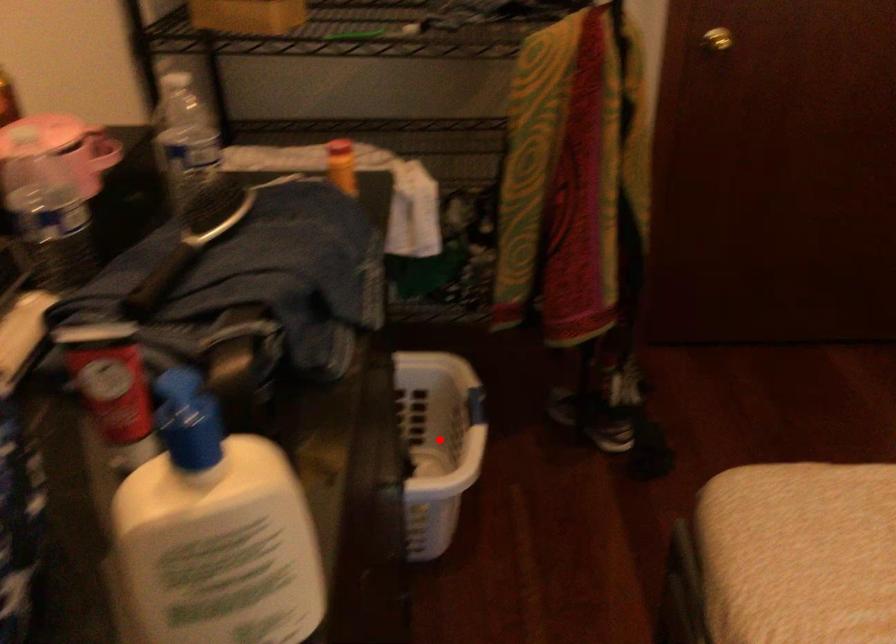
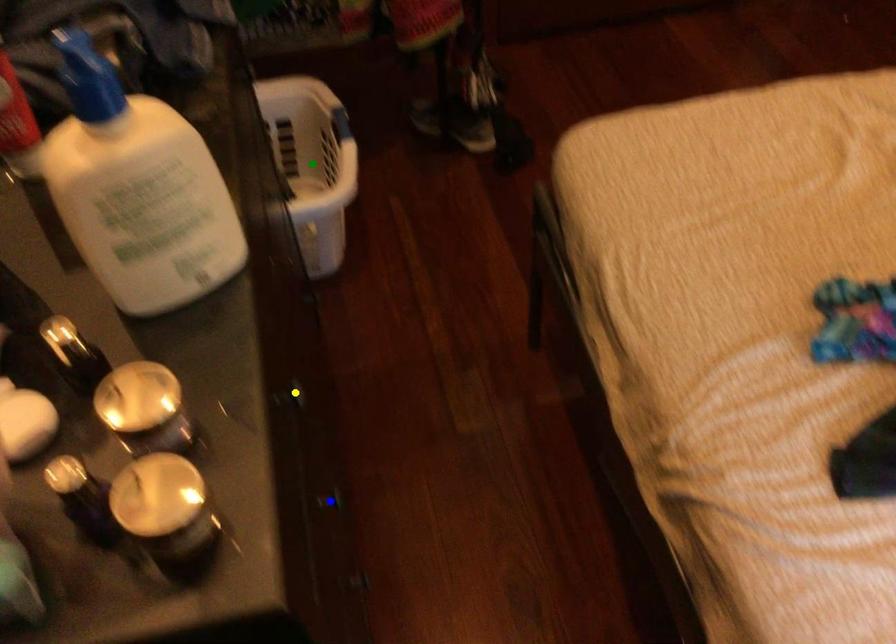
Question: I am providing you with two images of the same scene from different viewpoints. A red point is marked on the first image. You are given multiple points on the second image. Can you choose the point in image 2 that corresponds to the point in image 1?

Choices:
 (A) green point
 (B) yellow point
 (C) blue point

Answer: (A)